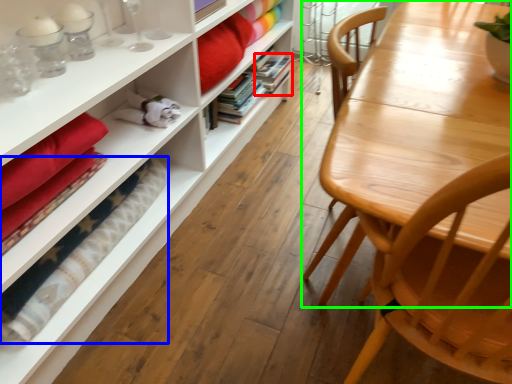
Question: Considering the real-world distances, which object is closest to book (highlighted by a red box)? blanket (highlighted by a blue box) or table (highlighted by a green box).

Choices:
 (A) blanket
 (B) table

Answer: (A)